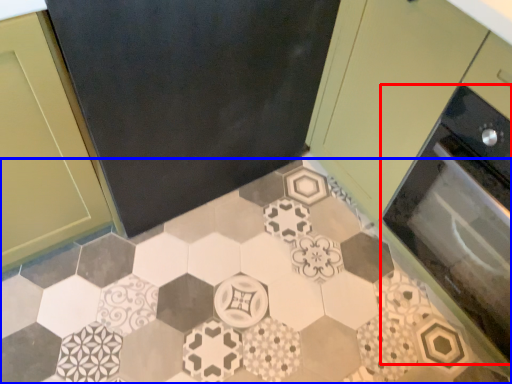
Question: Which object appears closest to the camera in this image, oven (highlighted by a red box) or ceramic tile (highlighted by a blue box)?

Choices:
 (A) oven
 (B) ceramic tile

Answer: (A)